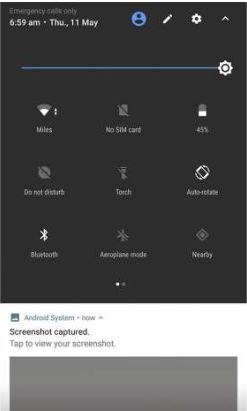
Image resolution: width=247 pixels, height=411 pixels. Identify the location of brightness slider. (222, 71).